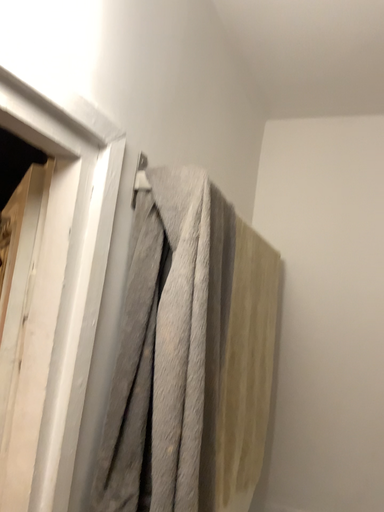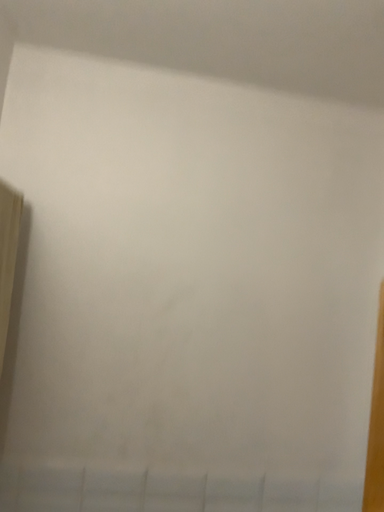
Question: Which way did the camera rotate in the video?

Choices:
 (A) rotated upward
 (B) rotated downward

Answer: (B)